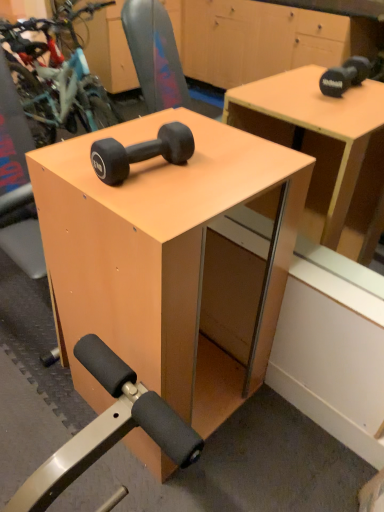
At what (x,y) coordinates should I click in order to perform the action: click on empty space that is ontop of matte wood dumbbell at center. Please return your answer as a coordinate pair (x, y). Image resolution: width=384 pixels, height=512 pixels. Looking at the image, I should click on (154, 158).